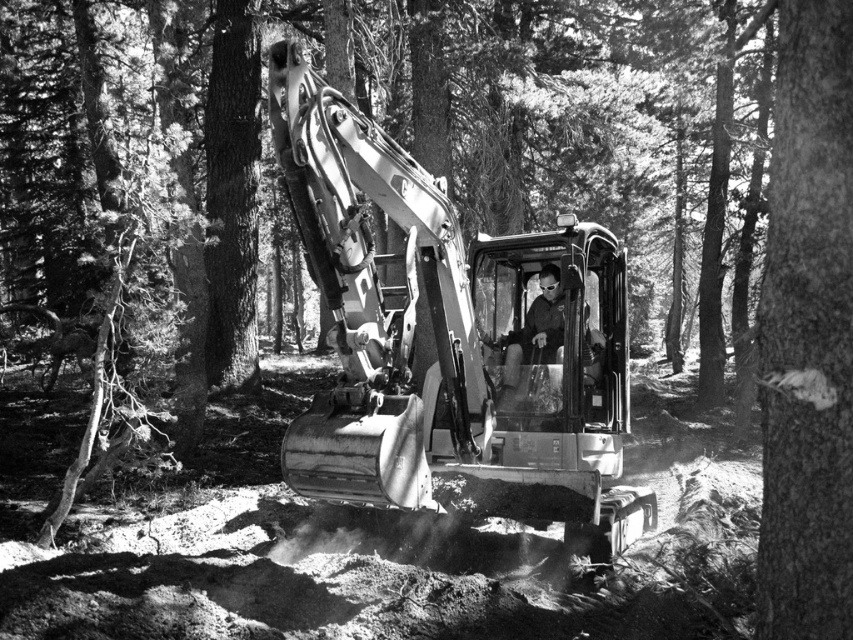
Please provide the exact coordinates of the metallic gray excavator at center in the image.

The metallic gray excavator at center is located at coordinates point (450, 337).

You are a forester assessing the forest area. You see the metallic gray excavator at center and the smooth bark tree at center right. Which object is positioned lower in the scene?

The metallic gray excavator at center is located below the smooth bark tree at center right, so the excavator is positioned lower in the scene.